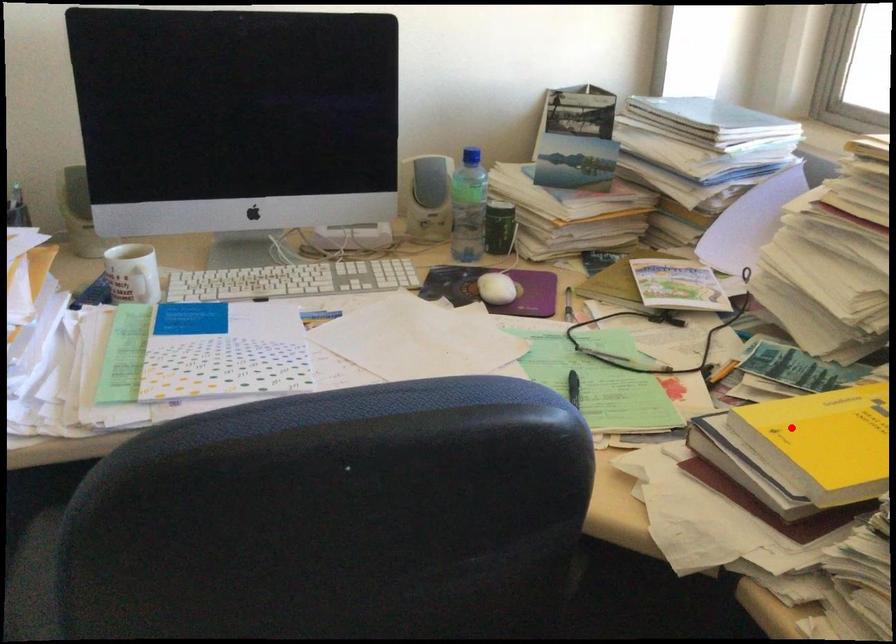
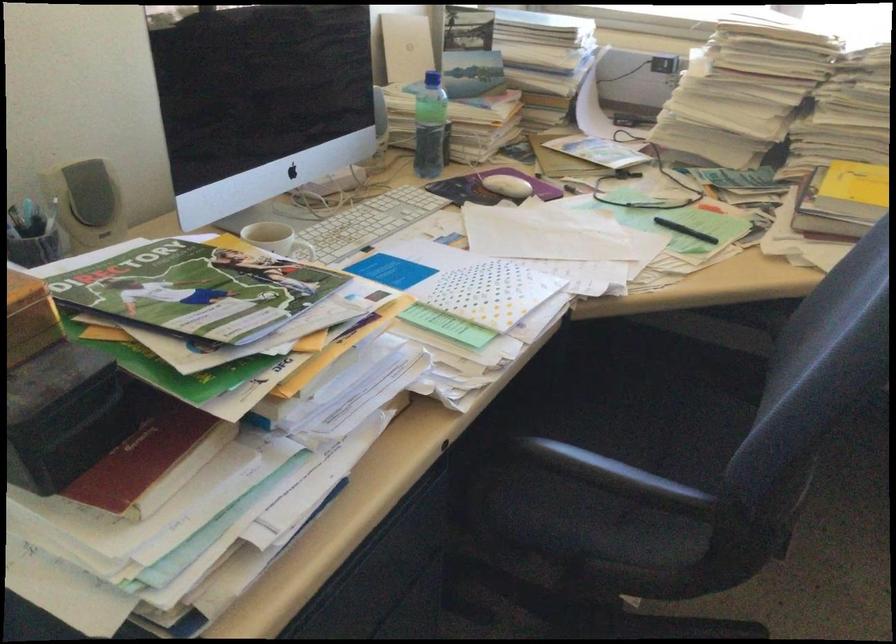
Find the pixel in the second image that matches the highlighted location in the first image.

(853, 194)